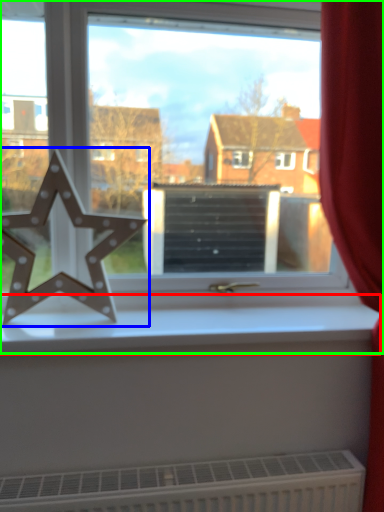
Question: Which object is the closest to the window sill (highlighted by a red box)? Choose among these: letter (highlighted by a blue box) or window (highlighted by a green box).

Choices:
 (A) letter
 (B) window

Answer: (A)